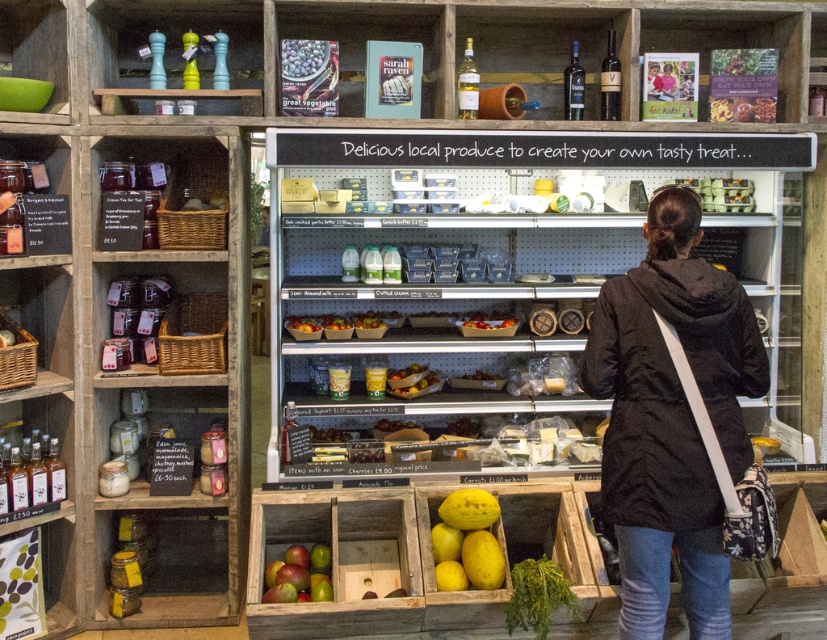
Does point (571, 209) come behind point (221, 96)?

Yes.

Identify the location of clear plastic shelves at center. This screenshot has width=827, height=640. (480, 275).

In the scene shown: Who is more distant from viewer, (1, 13) or (151, 49)?

Point (1, 13)

Does green matte bowl at upper left appear over matte plastic salt and pepper shakers at upper left?

Yes.

You are a GUI agent. You are given a task and a screenshot of the screen. Output one action in this format:
    pyautogui.click(x=<x>, y=<y>)
    Task: Click on the green matte bowl at upper left
    
    Given the screenshot: What is the action you would take?
    pyautogui.click(x=36, y=42)

Between clear plastic shelves at center and black fabric coat at center, which one has more height?

black fabric coat at center is taller.

Is clear plastic shelves at center further to camera compared to black fabric coat at center?

Yes, it is behind black fabric coat at center.

Identify the location of clear plastic shelves at center. This screenshot has width=827, height=640. (480, 275).

The image size is (827, 640). Identify the location of clear plastic shelves at center. (480, 275).